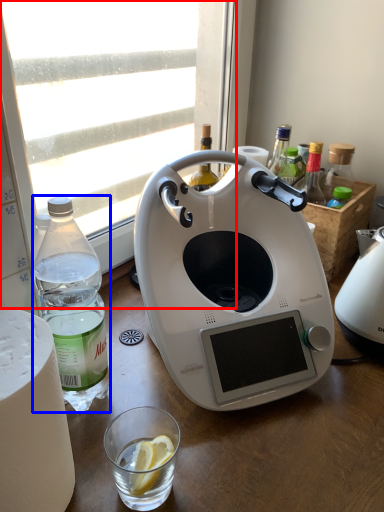
Question: Which object appears closest to the camera in this image, window (highlighted by a red box) or bottle (highlighted by a blue box)?

Choices:
 (A) window
 (B) bottle

Answer: (B)